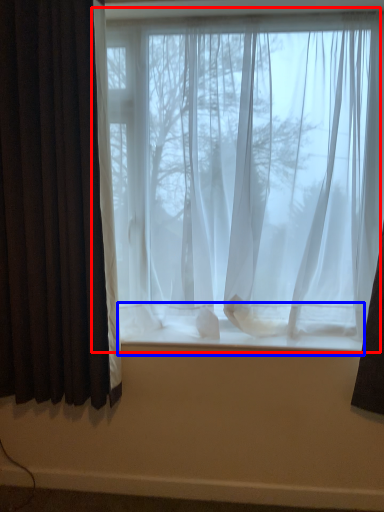
Question: Among these objects, which one is nearest to the camera, window (highlighted by a red box) or window sill (highlighted by a blue box)?

Choices:
 (A) window
 (B) window sill

Answer: (A)